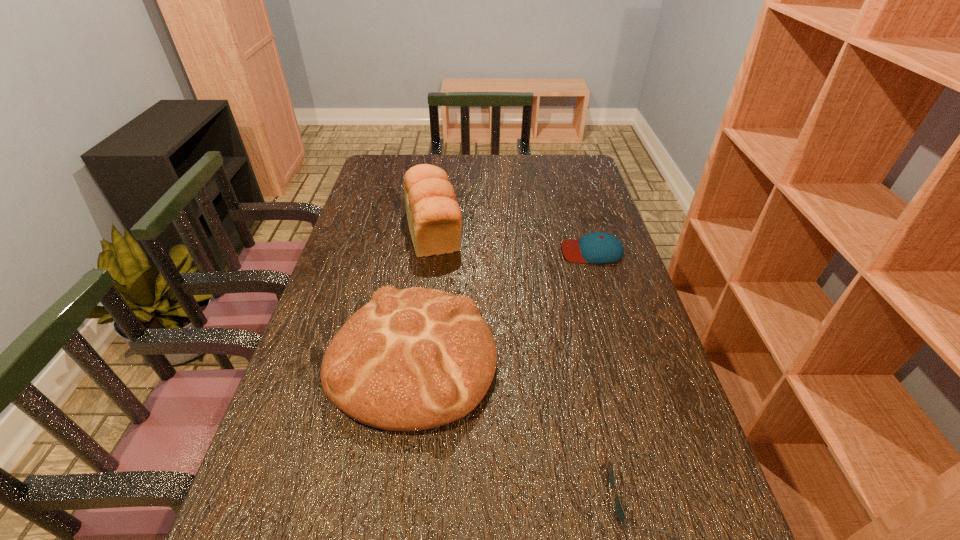
Where is `object at the left edge`? This screenshot has width=960, height=540. object at the left edge is located at coordinates (413, 359).

You are a GUI agent. You are given a task and a screenshot of the screen. Output one action in this format:
    pyautogui.click(x=<x>, y=<y>)
    Task: Click on the object that is positioned at the right edge
    This screenshot has width=960, height=540.
    Given the screenshot: What is the action you would take?
    pyautogui.click(x=598, y=247)

What are the coordinates of `vacant space at the far edge of the desktop` in the screenshot? It's located at (502, 165).

The width and height of the screenshot is (960, 540). I want to click on vacant space at the left edge of the desktop, so click(377, 234).

You are a GUI agent. You are given a task and a screenshot of the screen. Output one action in this format:
    pyautogui.click(x=<x>, y=<y>)
    Task: Click on the vacant space at the right edge
    
    Given the screenshot: What is the action you would take?
    pyautogui.click(x=684, y=515)

What are the coordinates of `vacant space at the far left corner of the desktop` in the screenshot? It's located at (384, 178).

Find the location of a particular element. The width and height of the screenshot is (960, 540). vacant region between the shorter bread and the third tallest object is located at coordinates (502, 305).

The height and width of the screenshot is (540, 960). In order to click on free area in between the second nearest object and the second shortest object in this screenshot , I will do `click(502, 305)`.

At what (x,y) coordinates should I click in order to perform the action: click on free space between the baseball cap and the shorter bread. Please return your answer as a coordinate pair (x, y). The height and width of the screenshot is (540, 960). Looking at the image, I should click on (502, 305).

Point out which object is positioned as the second nearest to the sunglasses. Please provide its 2D coordinates. Your answer should be formatted as a tuple, i.e. [(x, y)], where the tuple contains the x and y coordinates of a point satisfying the conditions above.

[(598, 247)]